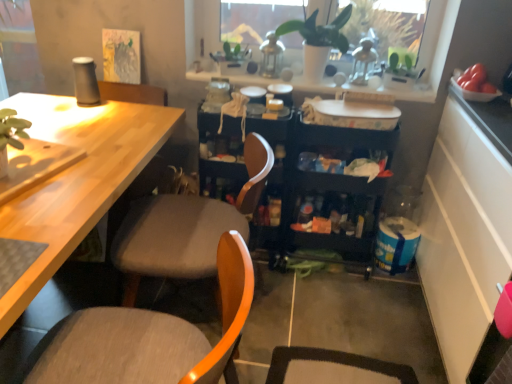
Question: Is black plastic storage cart at center not within white textured tray at upper center?

Choices:
 (A) no
 (B) yes

Answer: (B)

Question: Would you say black plastic storage cart at center contains white textured tray at upper center?

Choices:
 (A) yes
 (B) no

Answer: (B)

Question: Could you tell me if black plastic storage cart at center is turned towards white textured tray at upper center?

Choices:
 (A) yes
 (B) no

Answer: (B)

Question: Does black plastic storage cart at center have a smaller size compared to white textured tray at upper center?

Choices:
 (A) yes
 (B) no

Answer: (B)

Question: Is black plastic storage cart at center closer to the viewer compared to white textured tray at upper center?

Choices:
 (A) yes
 (B) no

Answer: (A)

Question: From the image's perspective, is white matte plant pot at upper center positioned above or below green matte plant at upper center?

Choices:
 (A) above
 (B) below

Answer: (A)

Question: Does point (404, 39) appear closer or farther from the camera than point (327, 46)?

Choices:
 (A) farther
 (B) closer

Answer: (A)

Question: From a real-world perspective, is white matte plant pot at upper center above or below green matte plant at upper center?

Choices:
 (A) below
 (B) above

Answer: (A)

Question: Is white matte plant pot at upper center bigger or smaller than green matte plant at upper center?

Choices:
 (A) big
 (B) small

Answer: (A)

Question: Is point [401, 89] closer or farther from the camera than point [408, 41]?

Choices:
 (A) closer
 (B) farther

Answer: (A)

Question: Is white textured tray at upper center inside the boundaries of white matte plant pot at upper center, or outside?

Choices:
 (A) inside
 (B) outside

Answer: (B)

Question: Relative to white matte plant pot at upper center, is white textured tray at upper center in front or behind?

Choices:
 (A) front
 (B) behind

Answer: (B)

Question: From a real-world perspective, is white textured tray at upper center above or below white matte plant pot at upper center?

Choices:
 (A) above
 (B) below

Answer: (B)

Question: Is point (381, 89) closer or farther from the camera than point (322, 71)?

Choices:
 (A) closer
 (B) farther

Answer: (A)

Question: From a real-world perspective, is white textured tray at upper center physically located above or below green matte plant at upper center?

Choices:
 (A) below
 (B) above

Answer: (A)